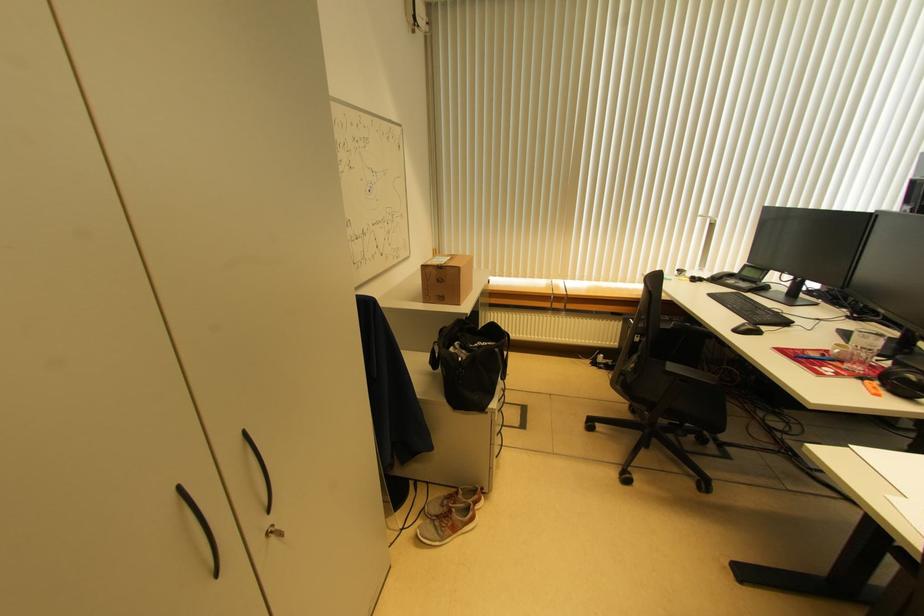
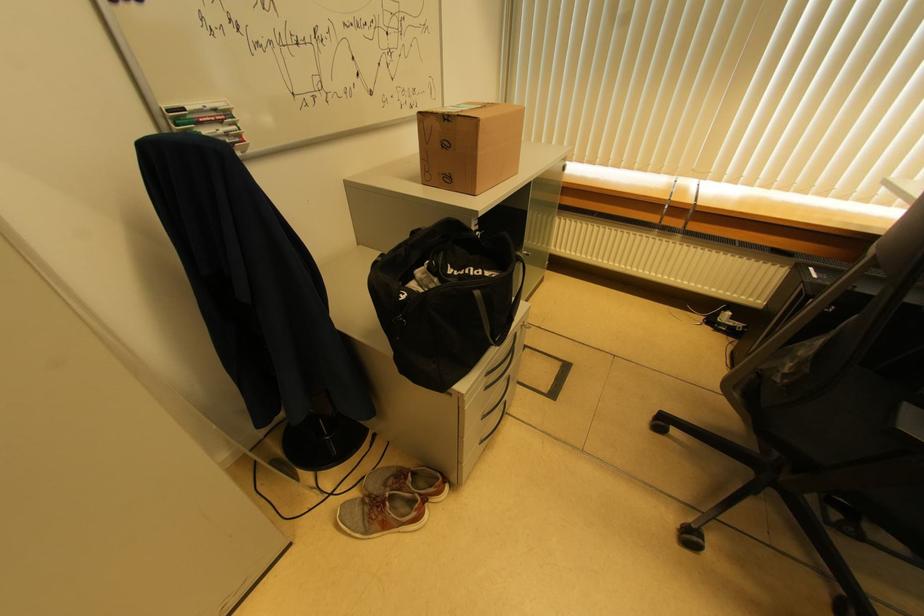
Find the pixel in the second image that matches (459,272) in the first image.

(477, 124)